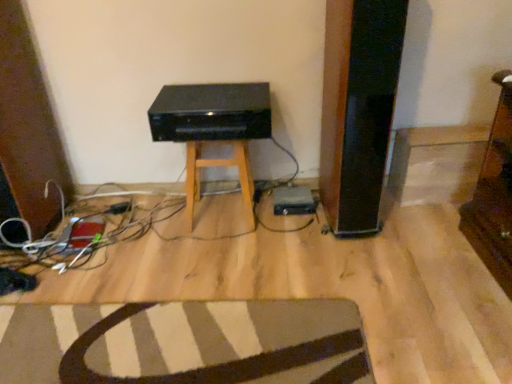
This screenshot has width=512, height=384. Identify the location of free spot to the right of black matte stool at center. (277, 219).